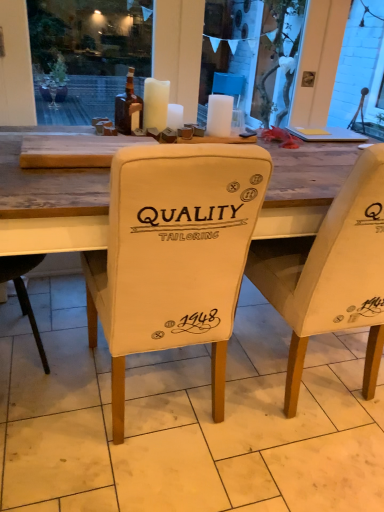
Question: Based on their sizes in the image, would you say white matte candle at upper center, arranged as the 3th candle when viewed from the left, is bigger or smaller than white fabric chair cover at center?

Choices:
 (A) small
 (B) big

Answer: (A)

Question: From a real-world perspective, is white matte candle at upper center, arranged as the 3th candle when viewed from the left, above or below white fabric chair cover at center?

Choices:
 (A) above
 (B) below

Answer: (A)

Question: Estimate the real-world distances between objects in this image. Which object is closer to the beige fabric chair at center, positioned as the second chair in left-to-right order?

Choices:
 (A) white matte candle at upper center, arranged as the 3th candle when viewed from the left
 (B) white matte candle at center, which is counted as the 2th candle, starting from the right
 (C) white fabric chair cover at center
 (D) white matte candle at upper center, which ranks as the third candle in right-to-left order
 (E) brown glass bottle at upper center

Answer: (C)

Question: Estimate the real-world distances between objects in this image. Which object is closer to the white matte candle at center, which is counted as the 2th candle, starting from the right?

Choices:
 (A) beige fabric chair at center, which is counted as the second chair, starting from the right
 (B) beige fabric chair at center, positioned as the second chair in left-to-right order
 (C) white matte candle at upper center, which appears as the first candle when viewed from the left
 (D) white fabric chair cover at center
 (E) white matte candle at upper center, which is the 1th candle in right-to-left order

Answer: (C)